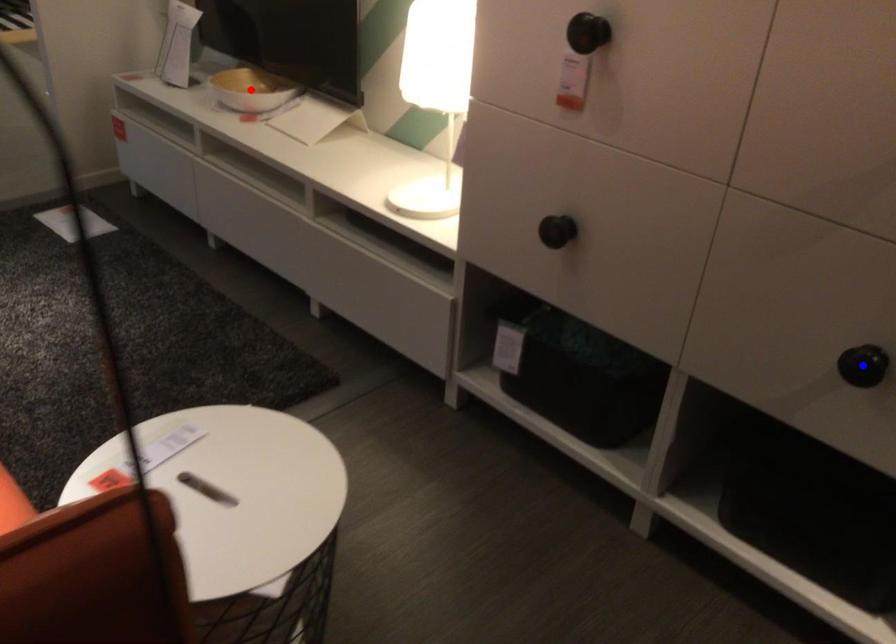
Question: In the image, two points are highlighted. Which point is nearer to the camera? Reply with the corresponding letter.

Choices:
 (A) blue point
 (B) red point

Answer: (A)